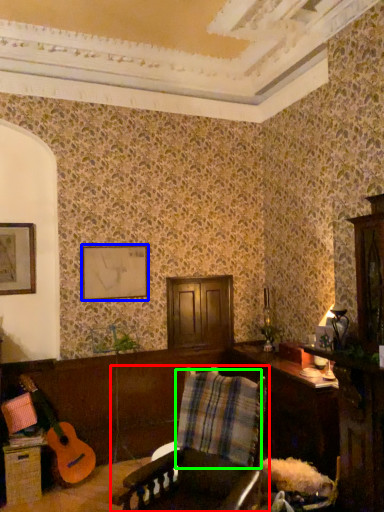
Question: Which object is the farthest from chair (highlighted by a red box)? Choose among these: picture frame (highlighted by a blue box) or plaid (highlighted by a green box).

Choices:
 (A) picture frame
 (B) plaid

Answer: (A)